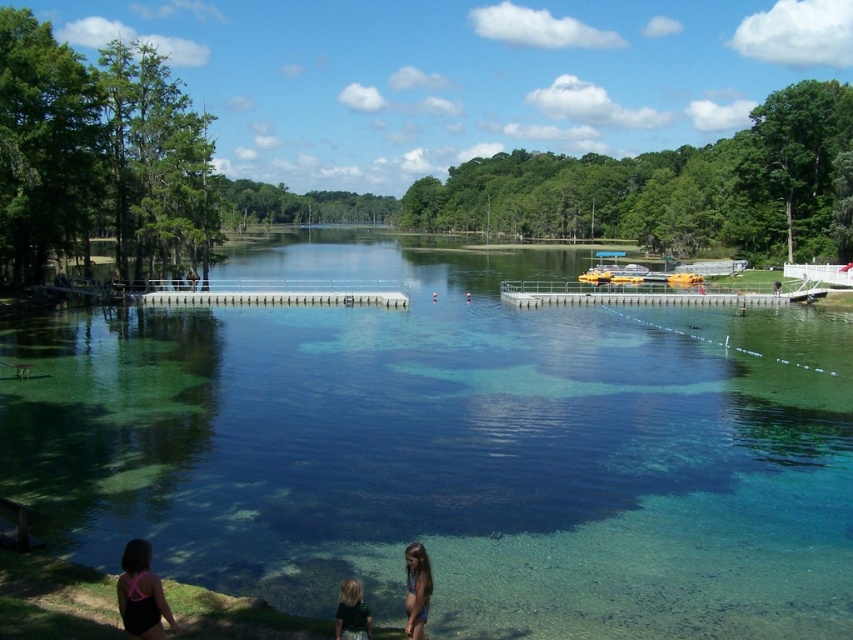
Question: Among these points, which one is farthest from the camera?

Choices:
 (A) (561, 285)
 (B) (416, 564)
 (C) (697, 278)
 (D) (676, 628)

Answer: (C)

Question: Considering the real-world distances, which object is farthest from the pink swimsuit at lower left?

Choices:
 (A) blonde hair at lower center
 (B) clear glass water at center
 (C) yellow rubber boat at center-right
 (D) light brown hair at lower center

Answer: (C)

Question: Is clear glass water at center to the right of light brown hair at lower center from the viewer's perspective?

Choices:
 (A) no
 (B) yes

Answer: (B)

Question: In this image, where is yellow metallic dock at center located relative to blonde hair at lower center?

Choices:
 (A) right
 (B) left

Answer: (A)

Question: Among these objects, which one is nearest to the camera?

Choices:
 (A) clear glass water at center
 (B) yellow rubber boat at center-right

Answer: (A)

Question: Is clear glass water at center positioned in front of blonde hair at lower center?

Choices:
 (A) no
 (B) yes

Answer: (A)